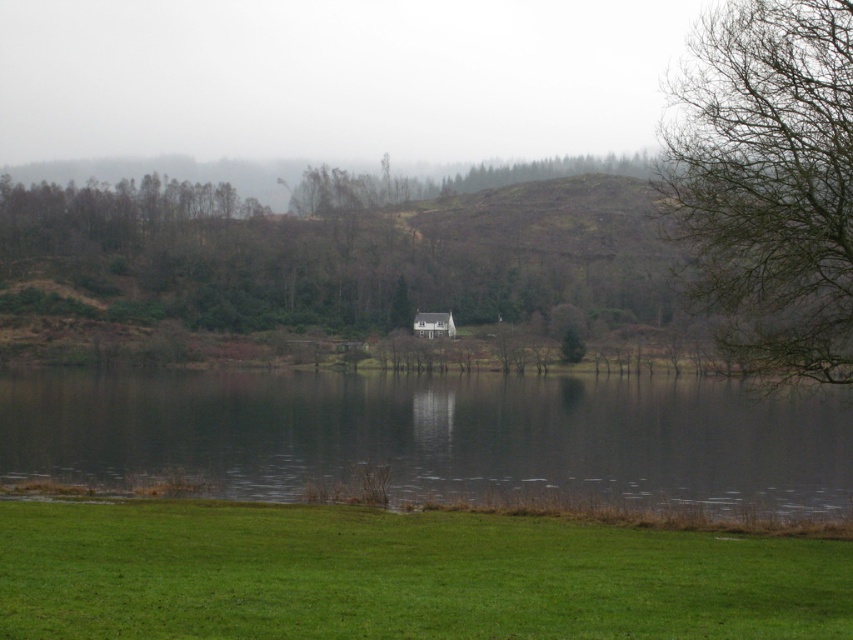
Does bare branches at right have a greater width compared to white wooden hut at center?

Yes, bare branches at right is wider than white wooden hut at center.

Which is more to the right, bare branches at right or white wooden hut at center?

bare branches at right is more to the right.

Is point (831, 230) closer to camera compared to point (427, 321)?

Yes, point (831, 230) is closer to viewer.

This screenshot has width=853, height=640. I want to click on bare branches at right, so click(x=769, y=180).

Does dark reflective water at center appear under white wooden hut at center?

Correct, dark reflective water at center is located below white wooden hut at center.

Who is taller, dark reflective water at center or white wooden hut at center?

dark reflective water at center is taller.

Who is more distant from viewer, (x=142, y=444) or (x=451, y=314)?

Point (x=451, y=314)

Where is `dark reflective water at center`? The width and height of the screenshot is (853, 640). dark reflective water at center is located at coordinates 434,436.

Can you confirm if dark reflective water at center is taller than bare branches at right?

Yes, dark reflective water at center is taller than bare branches at right.

Measure the distance from dark reflective water at center to bare branches at right.

dark reflective water at center is 62.18 meters from bare branches at right.

At what (x,y) coordinates should I click in order to perform the action: click on dark reflective water at center. Please return your answer as a coordinate pair (x, y). The width and height of the screenshot is (853, 640). Looking at the image, I should click on (434, 436).